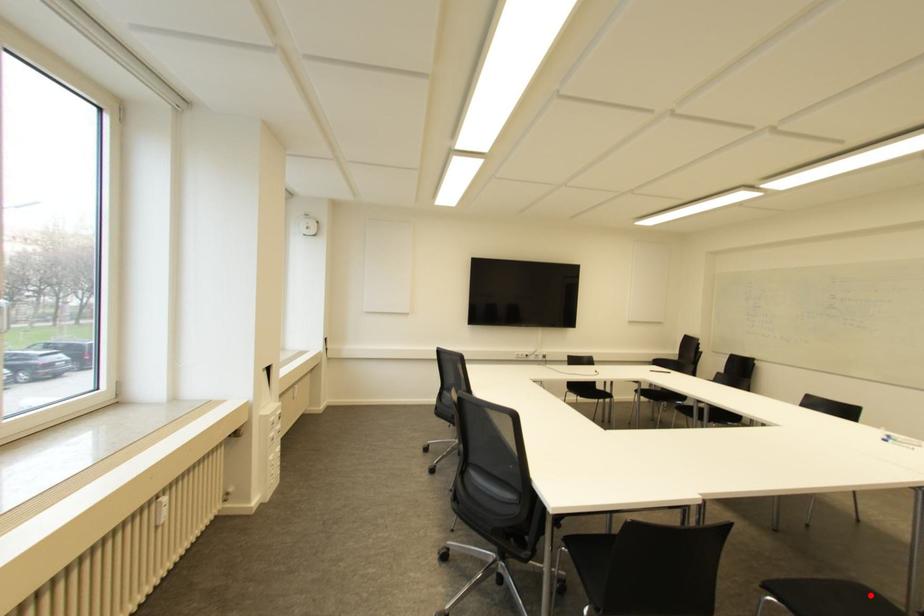
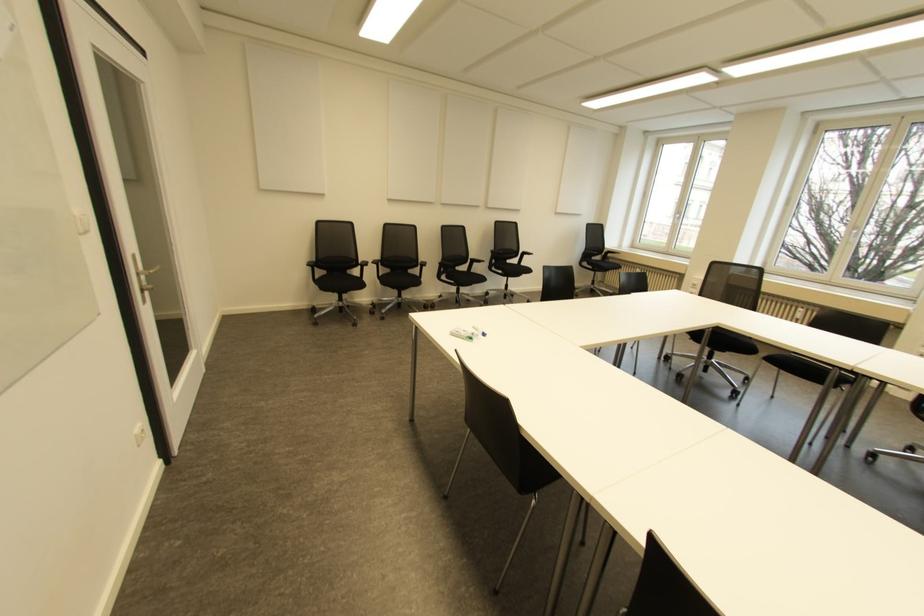
Question: I am providing you with two images of the same scene from different viewpoints. A red point is marked on the first image. Can you still see the location of the red point in image 2?

Choices:
 (A) Yes
 (B) No

Answer: (B)